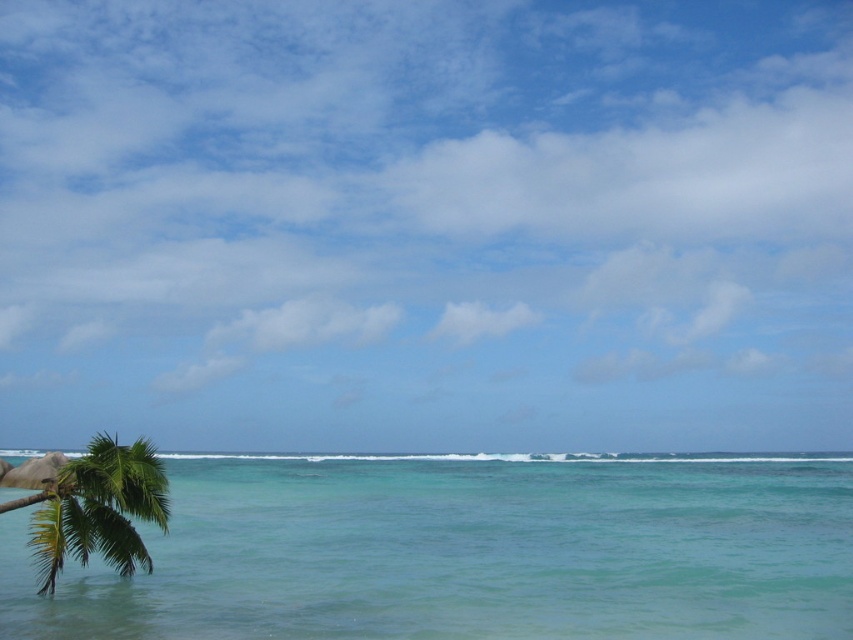
Question: Does turquoise glossy water at center have a larger size compared to green leafy palm tree at lower left?

Choices:
 (A) no
 (B) yes

Answer: (B)

Question: Which of the following is the closest to the observer?

Choices:
 (A) green leafy palm tree at lower left
 (B) turquoise glossy water at center

Answer: (B)

Question: Among these objects, which one is nearest to the camera?

Choices:
 (A) turquoise glossy water at center
 (B) green leafy palm tree at lower left

Answer: (A)

Question: Is turquoise glossy water at center above green leafy palm tree at lower left?

Choices:
 (A) yes
 (B) no

Answer: (B)

Question: Does turquoise glossy water at center appear under green leafy palm tree at lower left?

Choices:
 (A) no
 (B) yes

Answer: (B)